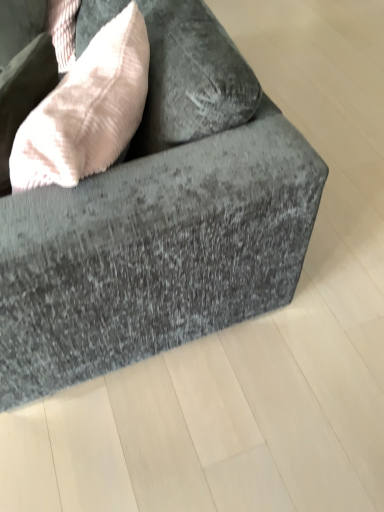
Question: Is light pink textured throw pillow at upper left next to velvet gray couch at center?

Choices:
 (A) yes
 (B) no

Answer: (B)

Question: Does light pink textured throw pillow at upper left turn towards velvet gray couch at center?

Choices:
 (A) no
 (B) yes

Answer: (B)

Question: Does light pink textured throw pillow at upper left appear on the left side of velvet gray couch at center?

Choices:
 (A) yes
 (B) no

Answer: (A)

Question: From the image's perspective, would you say light pink textured throw pillow at upper left is shown under velvet gray couch at center?

Choices:
 (A) yes
 (B) no

Answer: (A)

Question: Is light pink textured throw pillow at upper left oriented away from velvet gray couch at center?

Choices:
 (A) no
 (B) yes

Answer: (B)

Question: From the image's perspective, does light pink textured throw pillow at upper left appear higher than velvet gray couch at center?

Choices:
 (A) yes
 (B) no

Answer: (B)

Question: From a real-world perspective, does velvet gray couch at center sit lower than light pink textured throw pillow at upper left?

Choices:
 (A) yes
 (B) no

Answer: (A)

Question: Would you say velvet gray couch at center contains light pink textured throw pillow at upper left?

Choices:
 (A) no
 (B) yes

Answer: (B)

Question: Considering the relative sizes of velvet gray couch at center and light pink textured throw pillow at upper left in the image provided, is velvet gray couch at center shorter than light pink textured throw pillow at upper left?

Choices:
 (A) no
 (B) yes

Answer: (A)

Question: Can you confirm if velvet gray couch at center is wider than light pink textured throw pillow at upper left?

Choices:
 (A) yes
 (B) no

Answer: (A)

Question: Is velvet gray couch at center taller than light pink textured throw pillow at upper left?

Choices:
 (A) yes
 (B) no

Answer: (A)

Question: Is velvet gray couch at center far away from light pink textured throw pillow at upper left?

Choices:
 (A) yes
 (B) no

Answer: (B)

Question: Is point (56, 271) positioned closer to the camera than point (64, 153)?

Choices:
 (A) closer
 (B) farther

Answer: (B)